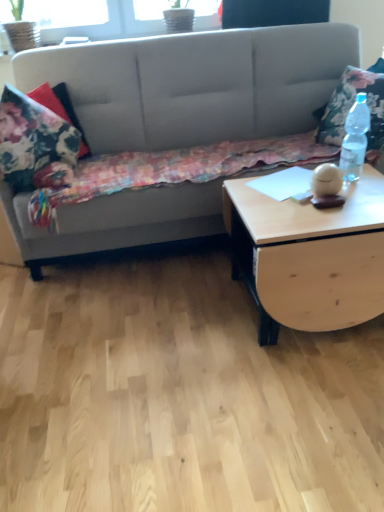
Identify the location of unoccupied region to the right of clear plastic bottle at right. (373, 174).